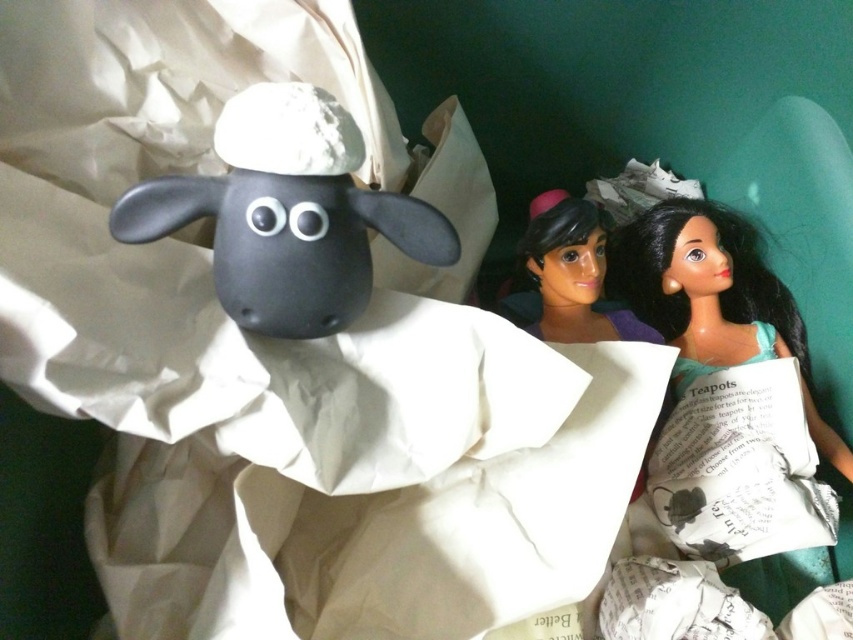
You are a toy organizer who needs to place a new toy between the matte black sheep at center and the smooth plastic doll at right. The new toy is 18 inches long. Will there be enough space for it?

The distance between the matte black sheep at center and the smooth plastic doll at right is 19.46 inches. Since the new toy is 18 inches long, there will be enough space for it as 18 inches is shorter than 19.46 inches.

You are trying to place a small sticker on the closest object to you in the scene. Which object should you choose between the matte black sheep at center and the smooth plastic doll at center?

The matte black sheep at center is closer to the viewer than the smooth plastic doll at center, so you should place the sticker on the matte black sheep at center.